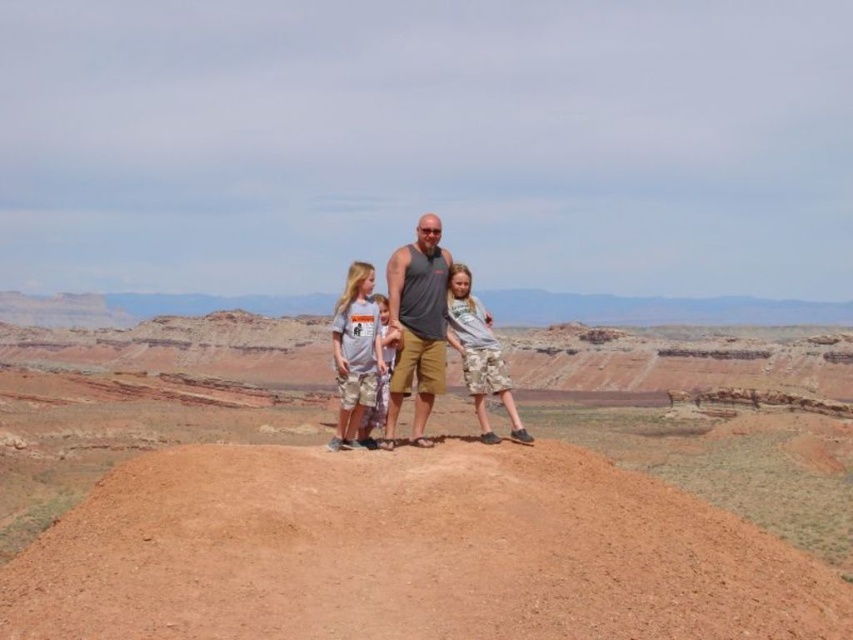
You are a photographer trying to capture a clear shot of the matte gray tank top at center and the camo shorts at center. Which one will appear larger in your photo?

The matte gray tank top at center will appear larger in the photo because it is closer to the viewer than the camo shorts at center.

You are a photographer trying to capture the group of people in the desert. You notice a specific point in the image at coordinates (x=418, y=324). What object is located at this point?

The point at coordinates (x=418, y=324) corresponds to the matte gray tank top at center.

You are a photographer trying to capture a clear shot of the matte gray tank top at center and the camouflage shorts at center. Which one is blocking the view of the other?

The matte gray tank top at center is in front of camouflage shorts at center, so it is blocking the view of the camouflage shorts at center.